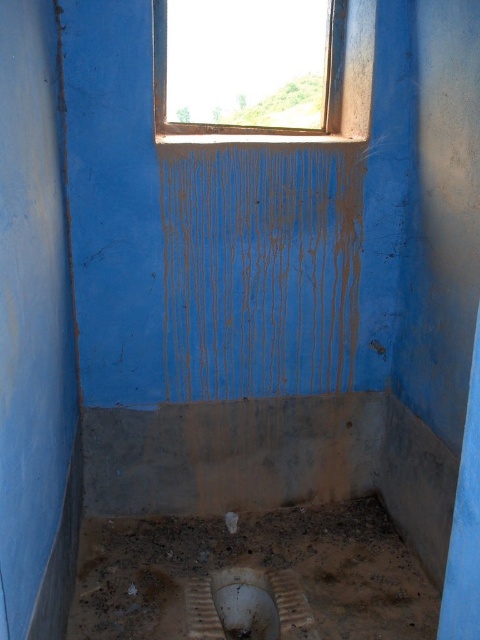
You are designing a layout for a bathroom and need to place a new cabinet between the metallic frame at upper center and the white matte toilet bowl at lower center. Considering their widths, which object requires more horizontal space for the cabinet?

The metallic frame at upper center requires more horizontal space for the cabinet because its width surpasses that of the white matte toilet bowl at lower center.

You are a maintenance worker needing to replace a broken part. You have a tool that is 6 feet long. You need to place it horizontally between the metallic frame at upper center and the white matte toilet bowl at lower center. Will the tool fit without bending it?

The distance between the metallic frame at upper center and the white matte toilet bowl at lower center is 5.64 feet. Since the tool is 6 feet long, it will extend beyond the space, so you can place it horizontally without bending it as there is enough space.

You are standing in the bathroom and see two points marked on the floor. The first point is at coordinate point (324, 113) and the second is at point (237, 573). If you want to move from the first point to the second, which direction should you move relative to the bathroom layout?

Point (324, 113) is behind point (237, 573), so you should move forward towards the second point.